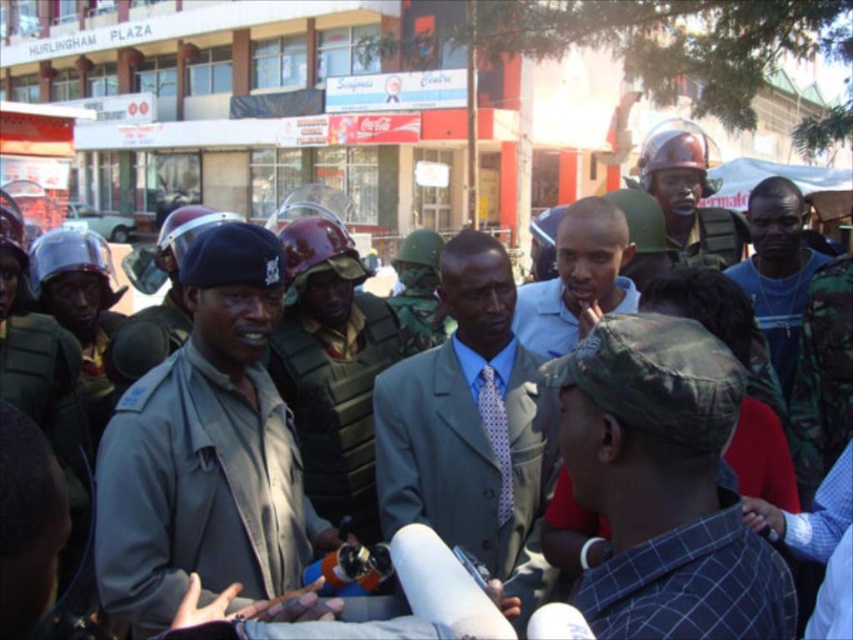
Measure the distance between point (144, 435) and camera.

9.68 feet

Is gray uniformed officer at center further to the viewer compared to camouflage uniform at center?

Result: No, it is not.

I want to click on gray uniformed officer at center, so click(x=206, y=451).

Is gray uniformed officer at center smaller than camo hat at center?

No.

Is point (248, 385) farther from camera compared to point (686, 384)?

Yes.

Who is more forward, (219, 355) or (654, 557)?

Point (654, 557)

Find the location of `gray uniformed officer at center`. gray uniformed officer at center is located at coordinates (206, 451).

What do you see at coordinates (206, 451) in the screenshot? This screenshot has height=640, width=853. I see `gray uniformed officer at center` at bounding box center [206, 451].

Is the position of gray uniformed officer at center more distant than that of light blue shirt at center?

No, it is not.

Which is in front, point (263, 346) or point (543, 332)?

Positioned in front is point (263, 346).

In order to click on gray uniformed officer at center in this screenshot , I will do `click(206, 451)`.